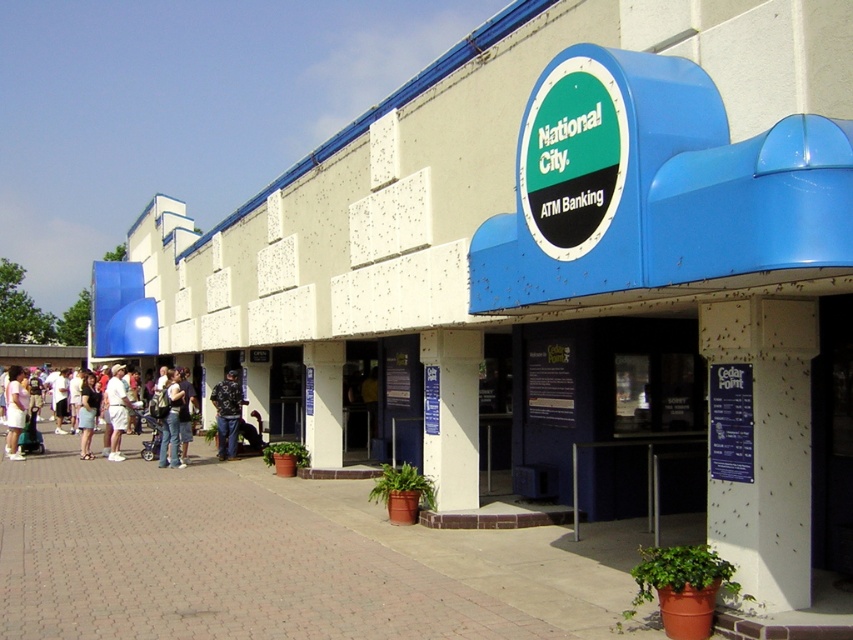
Does brick pavement at lower left appear under camouflage jacket at center?

Indeed, brick pavement at lower left is positioned under camouflage jacket at center.

Is brick pavement at lower left positioned at the back of camouflage jacket at center?

No, it is in front of camouflage jacket at center.

Between point (33, 561) and point (225, 426), which one is positioned behind?

Positioned behind is point (225, 426).

The image size is (853, 640). What are the coordinates of `brick pavement at lower left` in the screenshot? It's located at (212, 561).

Is point (10, 401) closer to camera compared to point (86, 378)?

That is True.

Is the position of matte white shirt at lower left less distant than that of light blue denim shorts at lower left?

Yes, matte white shirt at lower left is in front of light blue denim shorts at lower left.

Does point (7, 376) lie in front of point (80, 403)?

No, it is not.

Locate an element on the screen. matte white shirt at lower left is located at coordinates 15,410.

Which is more to the right, camouflage jacket at center or light blue denim shorts at lower left?

camouflage jacket at center is more to the right.

Which is behind, point (216, 385) or point (80, 438)?

The point (80, 438) is behind.

This screenshot has width=853, height=640. Identify the location of camouflage jacket at center. (227, 413).